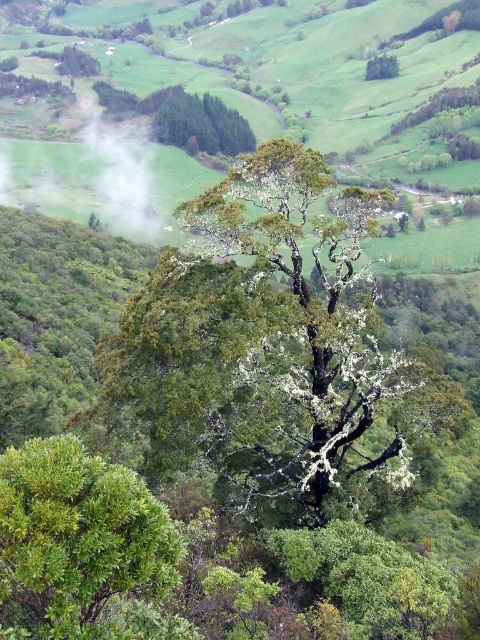
In the scene shown: You are standing in a lush landscape with a large tree in the foreground. You notice two points marked in the scene. The first point is located at coordinates point (x=317, y=396) and the second at point (x=223, y=113). Which of these points is nearer to your current position?

Point (x=317, y=396) is closer to the camera than point (x=223, y=113), so the first point is nearer to your current position.